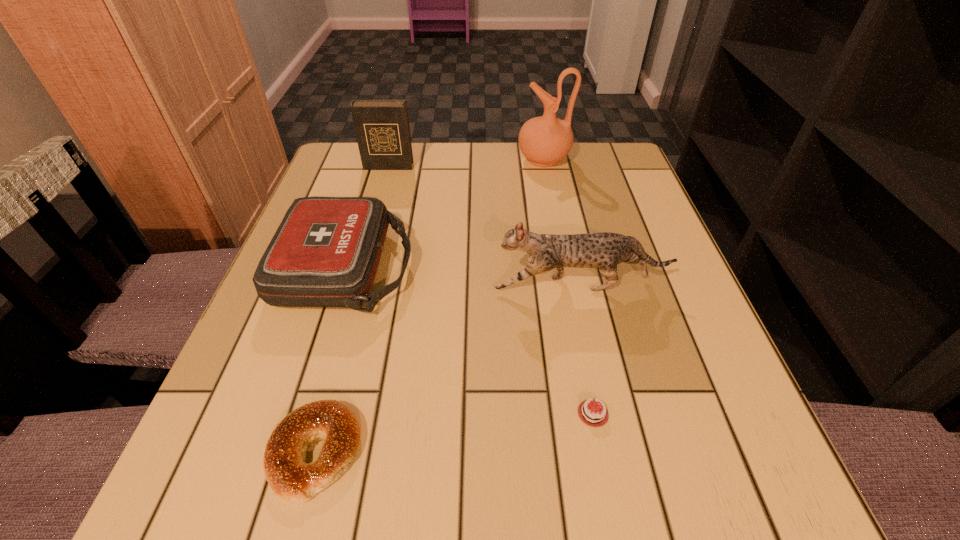
You are a GUI agent. You are given a task and a screenshot of the screen. Output one action in this format:
    pyautogui.click(x=<x>, y=<y>)
    Task: Click on the tallest object
    The image size is (960, 540).
    Given the screenshot: What is the action you would take?
    pyautogui.click(x=544, y=140)

This screenshot has width=960, height=540. Find the location of `diary`. diary is located at coordinates click(382, 129).

The width and height of the screenshot is (960, 540). In order to click on the third tallest object in this screenshot , I will do `click(604, 250)`.

Where is `the fourth tallest object`? This screenshot has height=540, width=960. the fourth tallest object is located at coordinates pos(326,251).

The height and width of the screenshot is (540, 960). In order to click on the fifth tallest object in this screenshot , I will do `click(289, 476)`.

Identify the location of the shortest object. 594,416.

Where is `free region located 0.230m on the spout of the tallest object`? This screenshot has height=540, width=960. free region located 0.230m on the spout of the tallest object is located at coordinates (429, 160).

Identify the location of vacant region located on the spout of the tallest object. Image resolution: width=960 pixels, height=540 pixels. (418, 160).

Identify the location of blank space located 0.060m on the spout of the tallest object. (494, 160).

You are a GUI agent. You are given a task and a screenshot of the screen. Output one action in this format:
    pyautogui.click(x=<x>, y=<y>)
    Task: Click on the vacant space situated 0.360m on the front cover of the diary
    The image size is (960, 540).
    Given the screenshot: What is the action you would take?
    pyautogui.click(x=359, y=269)